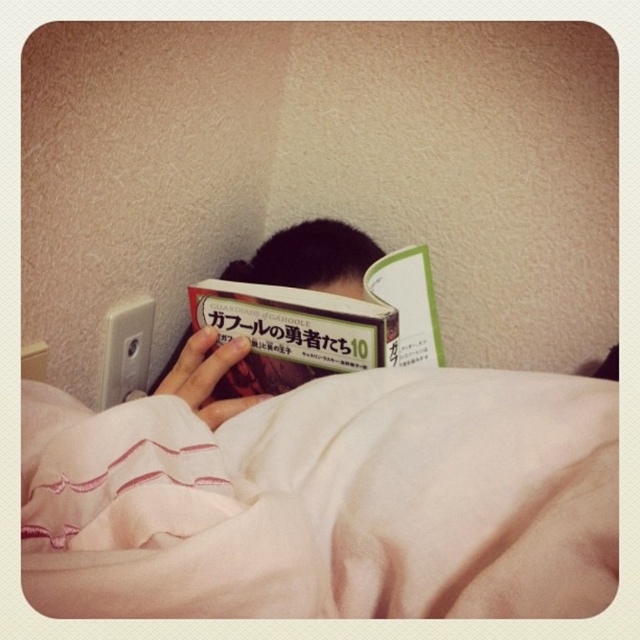
Does point (372, 531) come in front of point (221, 364)?

Yes, it is in front of point (221, 364).

Can you confirm if pink soft fabric blanket at lower center is positioned below matte black book at center?

Yes, pink soft fabric blanket at lower center is below matte black book at center.

Which is behind, point (97, 566) or point (326, 218)?

Positioned behind is point (326, 218).

Locate an element on the screen. The width and height of the screenshot is (640, 640). pink soft fabric blanket at lower center is located at coordinates (333, 502).

Is pink soft fabric blanket at lower center to the right of hardcover book at center from the viewer's perspective?

Yes, pink soft fabric blanket at lower center is to the right of hardcover book at center.

Is pink soft fabric blanket at lower center above hardcover book at center?

No.

Locate an element on the screen. This screenshot has height=640, width=640. pink soft fabric blanket at lower center is located at coordinates (333, 502).

This screenshot has height=640, width=640. Find the location of `pink soft fabric blanket at lower center`. pink soft fabric blanket at lower center is located at coordinates (333, 502).

Which is more to the right, hardcover book at center or matte black book at center?

hardcover book at center is more to the right.

Where is `hardcover book at center`? Image resolution: width=640 pixels, height=640 pixels. hardcover book at center is located at coordinates pyautogui.click(x=298, y=326).